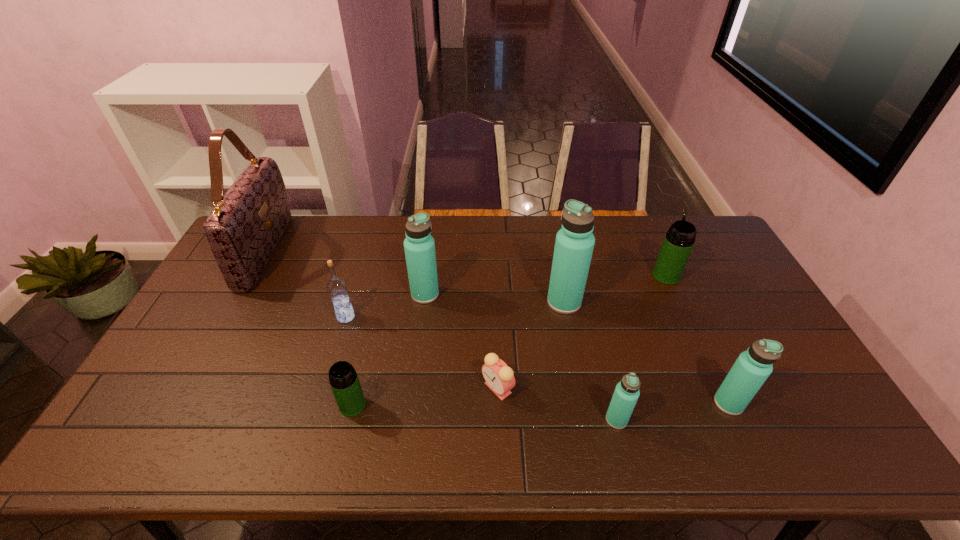
Where is `the eighth object from right to left`? The width and height of the screenshot is (960, 540). the eighth object from right to left is located at coordinates [337, 288].

Identify the location of the left green thermos bottle. (343, 379).

The image size is (960, 540). I want to click on the nearer green thermos bottle, so click(343, 379).

Where is `the smallest aqua thermos bottle`? This screenshot has width=960, height=540. the smallest aqua thermos bottle is located at coordinates (626, 394).

At what (x,y) coordinates should I click in order to perform the action: click on pink alarm clock. Please return your answer as a coordinate pair (x, y). The height and width of the screenshot is (540, 960). Looking at the image, I should click on (499, 377).

The height and width of the screenshot is (540, 960). What are the coordinates of `the fifth object from left to right` in the screenshot? It's located at (499, 377).

Identify the location of vacant area situated 0.240m on the front of the handbag with the clasp. (348, 251).

The height and width of the screenshot is (540, 960). In order to click on vacant point located 0.070m on the back of the tallest thermos bottle in this screenshot , I will do `click(559, 275)`.

At what (x,y) coordinates should I click in order to perform the action: click on free space located on the front of the third tallest object. Please return your answer as a coordinate pair (x, y). Looking at the image, I should click on (411, 404).

This screenshot has height=540, width=960. I want to click on vacant area situated 0.220m from the spout of the right green thermos bottle, so click(644, 228).